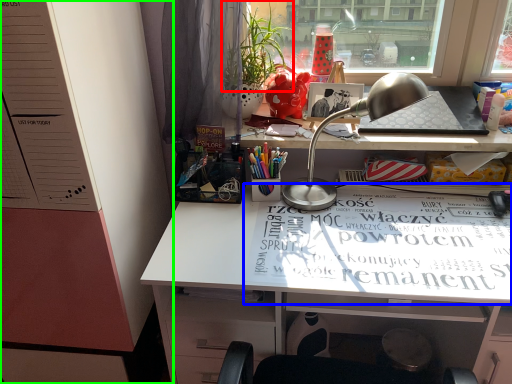
Question: Estimate the real-world distances between objects in this image. Which object is farther from plant (highlighted by a red box), magazine (highlighted by a blue box) or dresser (highlighted by a green box)?

Choices:
 (A) magazine
 (B) dresser

Answer: (A)